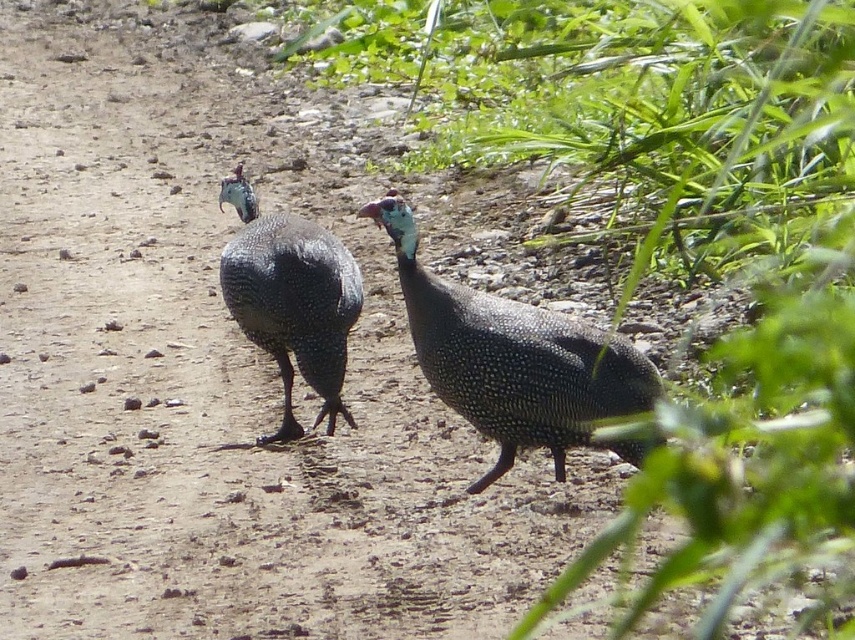
Question: Among these objects, which one is farthest from the camera?

Choices:
 (A) pearlized glossy guinea fowl at center
 (B) green leafy plant at center

Answer: (A)

Question: Can you confirm if pearlized glossy guinea fowl at center is positioned above satin blue guinea fowl at center?

Choices:
 (A) yes
 (B) no

Answer: (B)

Question: Where is green leafy plant at center located in relation to pearlized glossy guinea fowl at center in the image?

Choices:
 (A) above
 (B) below

Answer: (A)

Question: Is green leafy plant at center smaller than satin blue guinea fowl at center?

Choices:
 (A) yes
 (B) no

Answer: (B)

Question: Among these points, which one is nearest to the camera?

Choices:
 (A) (290, 404)
 (B) (818, 419)
 (C) (534, 353)

Answer: (B)

Question: Which of the following is the farthest from the observer?

Choices:
 (A) (317, 355)
 (B) (640, 496)
 (C) (492, 481)

Answer: (A)